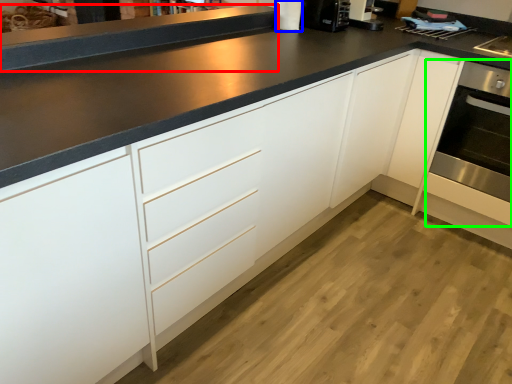
Question: Which object is the farthest from counter top (highlighted by a red box)? Choose among these: appliance (highlighted by a blue box) or oven (highlighted by a green box).

Choices:
 (A) appliance
 (B) oven

Answer: (B)